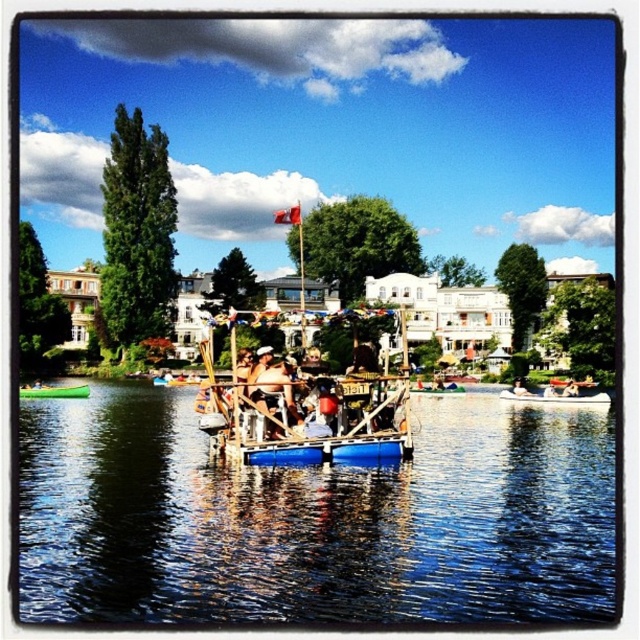
Looking at this image, you are planning to organize a picnic on the water. You have two options for the picnic spot, the blue wooden raft at center and the white plastic boat at center. Based on their sizes, which one can accommodate more people comfortably?

The blue wooden raft at center is wider than the white plastic boat at center, so it can accommodate more people comfortably.

You are standing on the dock and looking at the white plastic boat at center. Where exactly is the point at coordinates [554,394] located?

The point at coordinates [554,394] is located on the white plastic boat at center.